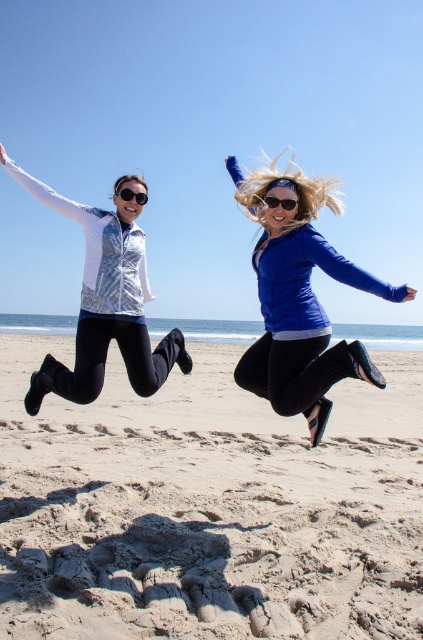
What do you see at coordinates (280, 202) in the screenshot?
I see `transparent plastic goggles at center` at bounding box center [280, 202].

Which of these two, transparent plastic goggles at center or black plastic goggles at upper center, stands shorter?

With less height is transparent plastic goggles at center.

The image size is (423, 640). In order to click on transparent plastic goggles at center in this screenshot , I will do `click(280, 202)`.

Does blue matte jacket at upper right have a smaller size compared to transparent plastic goggles at center?

Incorrect, blue matte jacket at upper right is not smaller in size than transparent plastic goggles at center.

Between blue matte jacket at upper right and transparent plastic goggles at center, which one appears on the left side from the viewer's perspective?

From the viewer's perspective, transparent plastic goggles at center appears more on the left side.

Is point (373, 291) positioned after point (269, 195)?

That is False.

This screenshot has height=640, width=423. What are the coordinates of `blue matte jacket at upper right` in the screenshot? It's located at (302, 307).

Can you confirm if blue matte jacket at upper right is thinner than white textured vest at left?

Correct, blue matte jacket at upper right's width is less than white textured vest at left's.

Who is more forward, (299, 301) or (102, 378)?

Positioned in front is point (299, 301).

Where is `blue matte jacket at upper right`? The width and height of the screenshot is (423, 640). blue matte jacket at upper right is located at coordinates (302, 307).